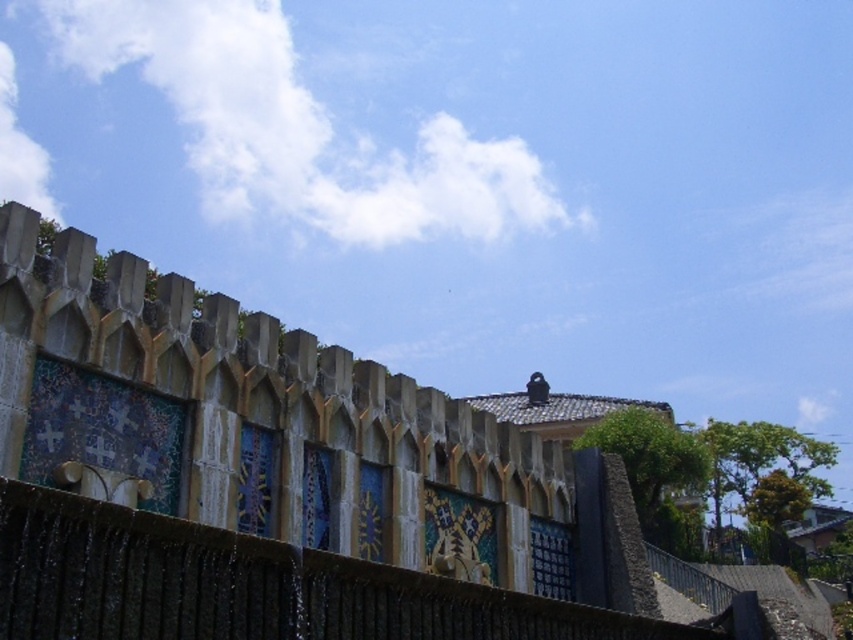
Question: Can you confirm if smooth concrete fence at center is positioned above smooth concrete fence at lower center?

Choices:
 (A) no
 (B) yes

Answer: (B)

Question: Does smooth concrete fence at center appear under smooth concrete fence at lower center?

Choices:
 (A) no
 (B) yes

Answer: (A)

Question: Observing the image, what is the correct spatial positioning of smooth concrete fence at center in reference to smooth concrete fence at lower center?

Choices:
 (A) above
 (B) below

Answer: (A)

Question: Which of the following is the farthest from the observer?

Choices:
 (A) (218, 368)
 (B) (202, 634)

Answer: (A)